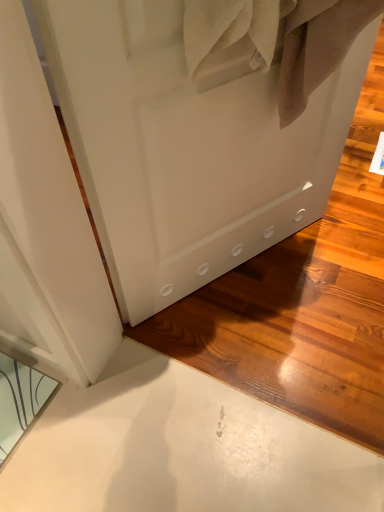
You are a GUI agent. You are given a task and a screenshot of the screen. Output one action in this format:
    pyautogui.click(x=<x>, y=<y>)
    Task: Click on the unoccupied region to the right of clear glass mirror at lower left
    The height and width of the screenshot is (512, 384).
    Given the screenshot: What is the action you would take?
    pyautogui.click(x=86, y=425)